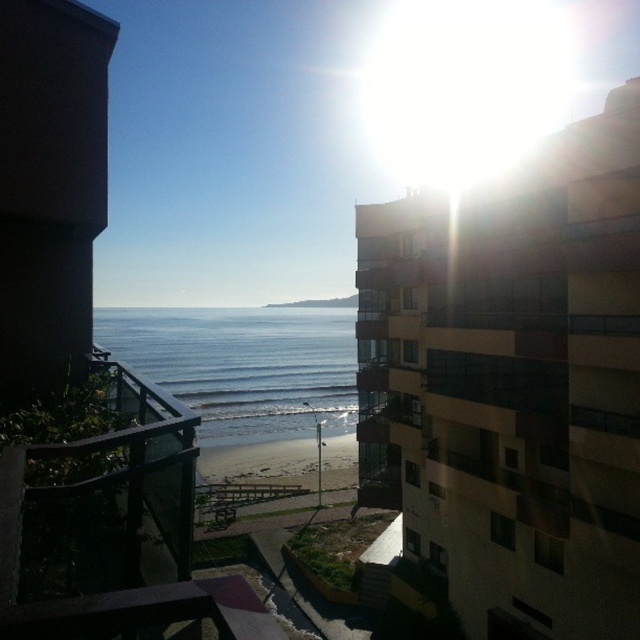
You are standing on the balcony and want to take a photo of the blue glassy water at center. Where should you point your camera to capture it?

You should point your camera towards the center of the scene at coordinates approximately 0.572 on the x axis and 0.380 on the y axis to capture the blue glassy water at center.

You are standing on the balcony and want to look at two points in the scene. The first point is point (12,625) and the second is point (298,456). Which point is closer to you?

Point (12,625) is closer to you because it is in front of point (298,456).